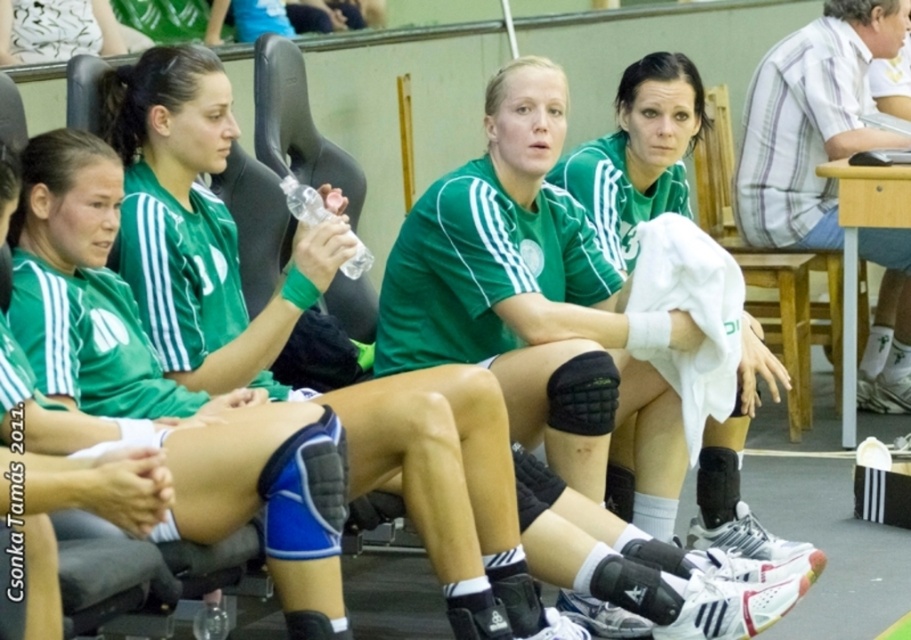
Question: Is matte green jersey at center wider than matte green uniform at center?

Choices:
 (A) no
 (B) yes

Answer: (B)

Question: Can you confirm if matte green jersey at center is positioned below matte green uniform at center?

Choices:
 (A) yes
 (B) no

Answer: (A)

Question: Which point appears closest to the camera in this image?

Choices:
 (A) (599, 196)
 (B) (763, 616)

Answer: (B)

Question: Which point is closer to the camera?

Choices:
 (A) (176, 272)
 (B) (672, 192)

Answer: (A)

Question: Is matte green jersey at center bigger than matte green uniform at center?

Choices:
 (A) no
 (B) yes

Answer: (B)